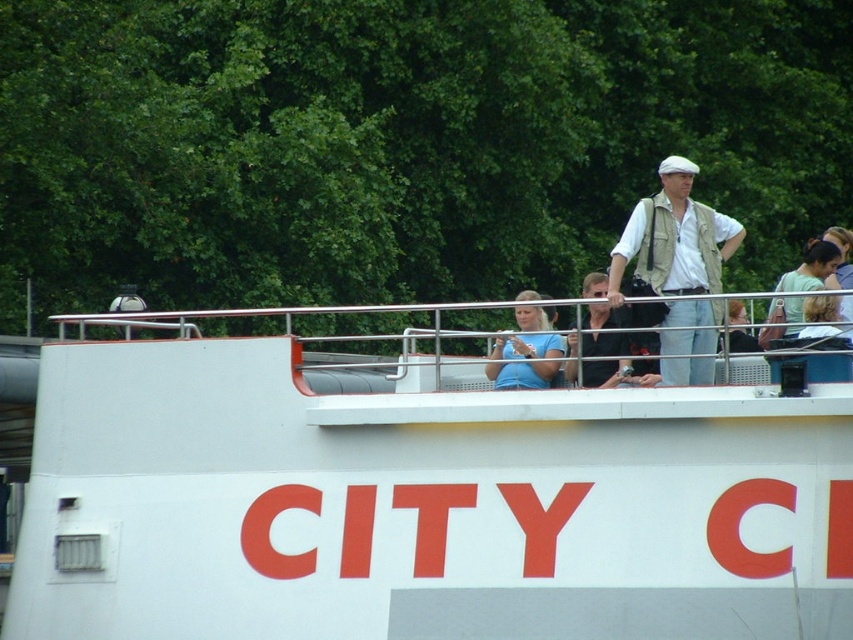
Consider the image. Between light beige vest at center and matte blue shirt at center, which one is positioned lower?

matte blue shirt at center is below.

Which is in front, point (630, 250) or point (544, 353)?

Point (630, 250) is more forward.

At what (x,y) coordinates should I click in order to perform the action: click on light beige vest at center. Please return your answer as a coordinate pair (x, y). Looking at the image, I should click on (674, 237).

Identify the location of light beige vest at center. (674, 237).

Can you confirm if light beige vest at center is bigger than light brown wooden chair at upper center?

Actually, light beige vest at center might be smaller than light brown wooden chair at upper center.

From the picture: How far apart are light beige vest at center and light brown wooden chair at upper center?

They are 25.22 inches apart.

Where is `light beige vest at center`? The image size is (853, 640). light beige vest at center is located at coordinates click(x=674, y=237).

The width and height of the screenshot is (853, 640). What do you see at coordinates (524, 362) in the screenshot?
I see `matte blue shirt at center` at bounding box center [524, 362].

Who is lower down, matte blue shirt at center or light brown wooden chair at upper center?

matte blue shirt at center is lower down.

In order to click on matte blue shirt at center in this screenshot , I will do `click(524, 362)`.